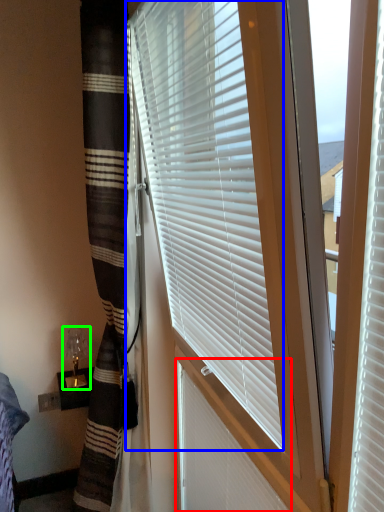
Question: Considering the real-world distances, which object is closest to shutter (highlighted by a red box)? window blind (highlighted by a blue box) or table lamp (highlighted by a green box).

Choices:
 (A) window blind
 (B) table lamp

Answer: (A)